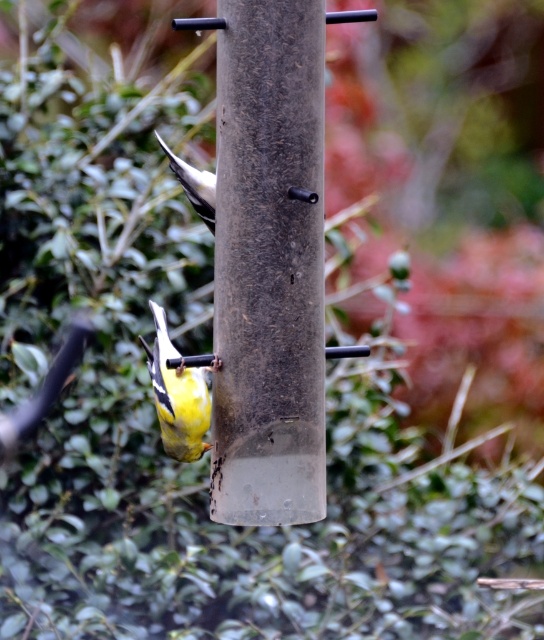
You are standing in front of the bird feeder and want to take a photo of both birds. Which point, point (168, 348) or point (213, 189), is closer to you?

Point (168, 348) is in front of point (213, 189), so it is closer to you.

You are standing in a park and see the bird feeder with two birds. There is a point at coordinates (268, 264). What object is located at that point?

The point at (268, 264) indicates a smooth brown pole at center.